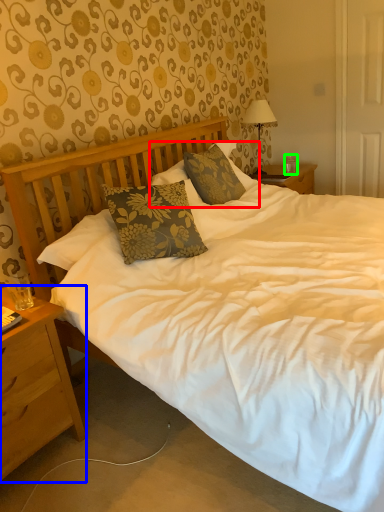
Question: Which object is the farthest from pillow (highlighted by a red box)? Choose among these: nightstand (highlighted by a blue box) or coffee cup (highlighted by a green box).

Choices:
 (A) nightstand
 (B) coffee cup

Answer: (B)